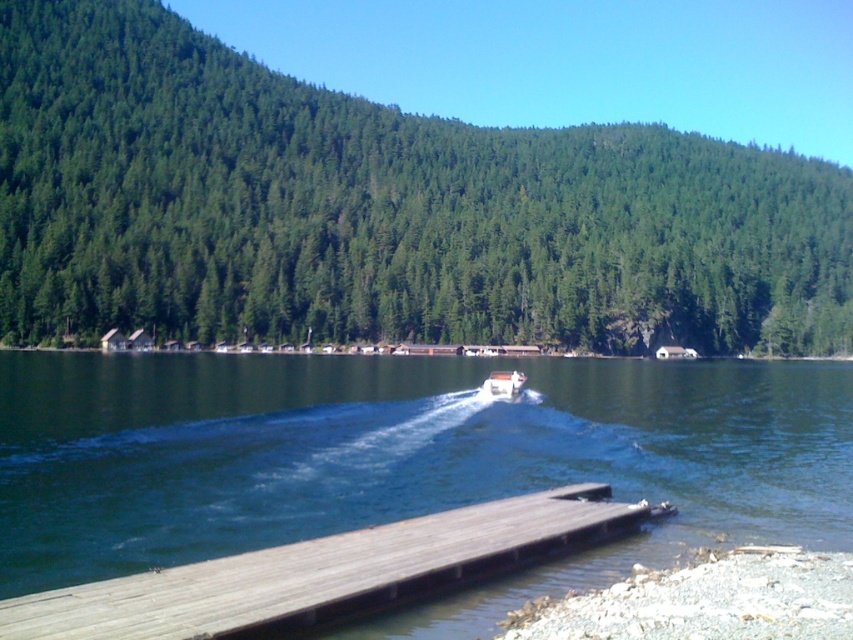
Does smooth gravel shore at lower right have a greater width compared to white plastic boat at center?

In fact, smooth gravel shore at lower right might be narrower than white plastic boat at center.

Can you confirm if smooth gravel shore at lower right is smaller than white plastic boat at center?

Correct, smooth gravel shore at lower right occupies less space than white plastic boat at center.

Does point (502, 636) come closer to viewer compared to point (494, 371)?

Yes, it is.

In order to click on smooth gravel shore at lower right in this screenshot , I will do `click(706, 600)`.

Consider the image. Does green matte forest at upper center have a greater height compared to smooth gravel shore at lower right?

Yes, green matte forest at upper center is taller than smooth gravel shore at lower right.

Consider the image. Can you confirm if green matte forest at upper center is wider than smooth gravel shore at lower right?

Yes, green matte forest at upper center is wider than smooth gravel shore at lower right.

What do you see at coordinates (379, 209) in the screenshot?
I see `green matte forest at upper center` at bounding box center [379, 209].

You are a GUI agent. You are given a task and a screenshot of the screen. Output one action in this format:
    pyautogui.click(x=<x>, y=<y>)
    Task: Click on the green matte forest at upper center
    This screenshot has height=640, width=853.
    Given the screenshot: What is the action you would take?
    pyautogui.click(x=379, y=209)

Can you confirm if green matte forest at upper center is shorter than white plastic boat at center?

Incorrect, green matte forest at upper center's height does not fall short of white plastic boat at center's.

In order to click on green matte forest at upper center in this screenshot , I will do `click(379, 209)`.

Does point (200, 124) come in front of point (506, 378)?

No, it is not.

Where is `green matte forest at upper center`? This screenshot has width=853, height=640. green matte forest at upper center is located at coordinates (379, 209).